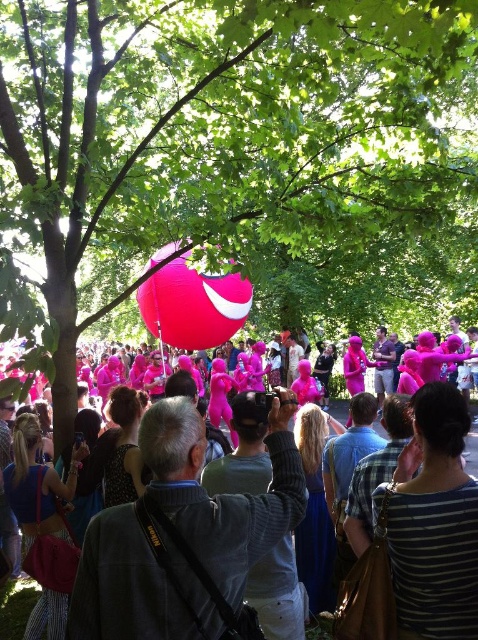
You are planning to take a photo of the green leafy tree at upper center and the glossy pink balloon at center. Which object should you focus on first if you want to capture both in a single frame without moving the camera?

The green leafy tree at upper center is larger in size than the glossy pink balloon at center, so you should focus on the green leafy tree at upper center first to ensure it fills the frame appropriately before adjusting for the smaller balloon.